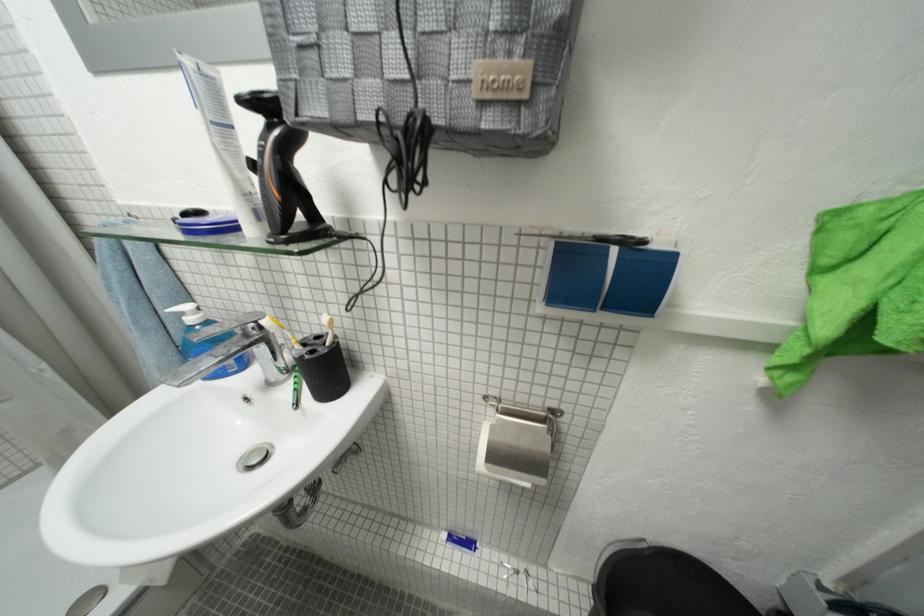
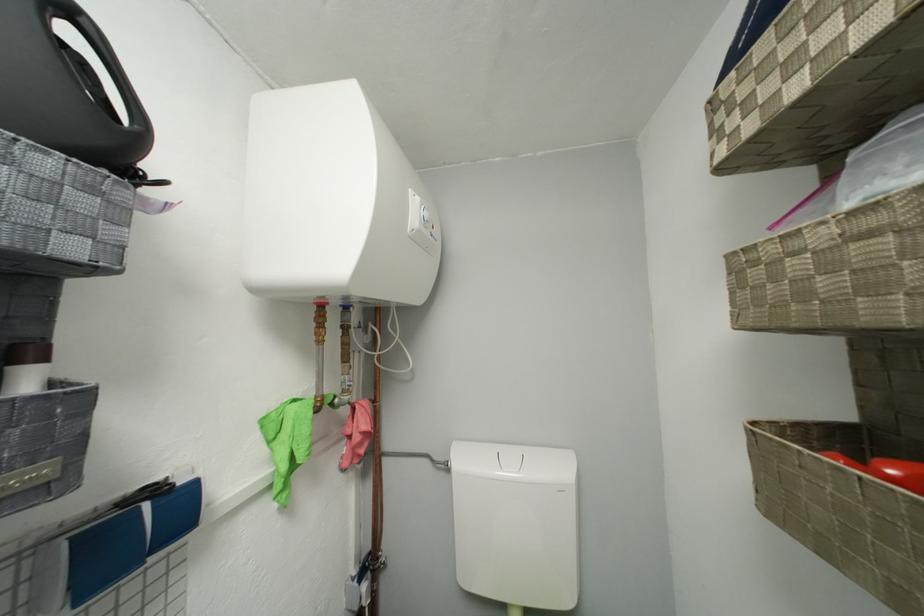
Find the pixel in the second image that matches point (836, 331) in the first image.

(293, 469)